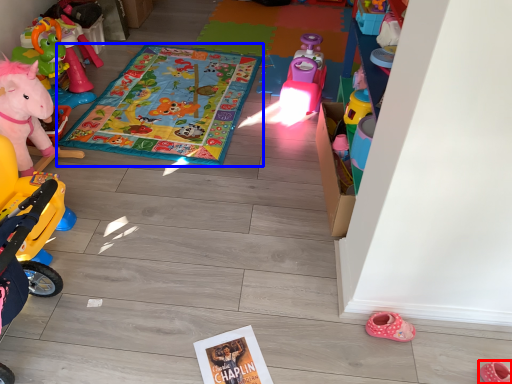
Question: Among these objects, which one is farthest to the camera, footwear (highlighted by a red box) or blanket (highlighted by a blue box)?

Choices:
 (A) footwear
 (B) blanket

Answer: (B)